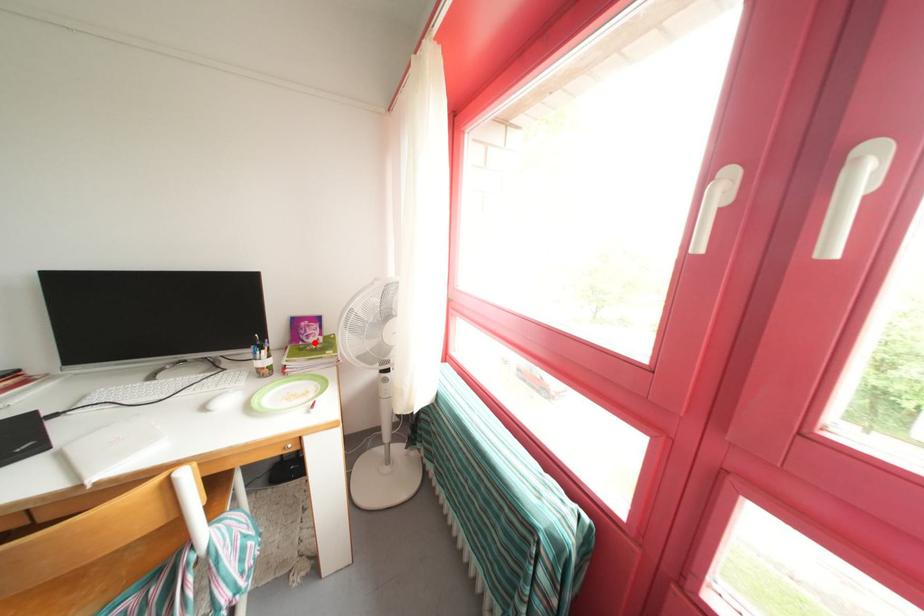
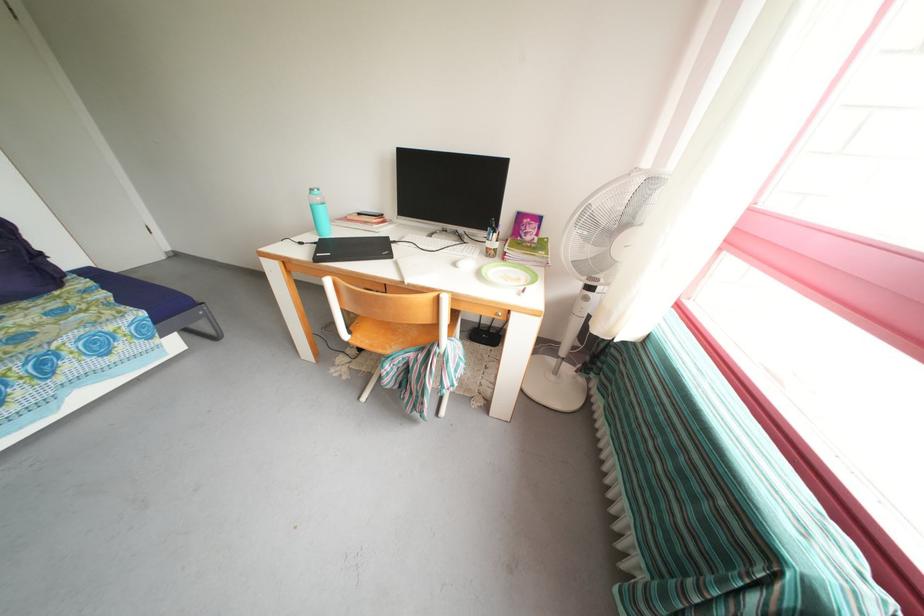
In the second image, find the point that corresponds to the highlighted location in the first image.

(532, 238)